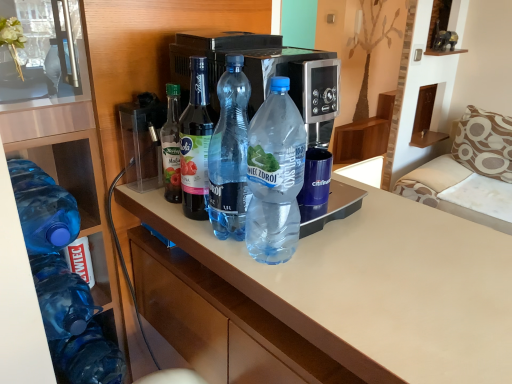
The image size is (512, 384). I want to click on unoccupied area in front of blue translucent bottle at center, which is counted as the 5th bottle, starting from the left, so [311, 296].